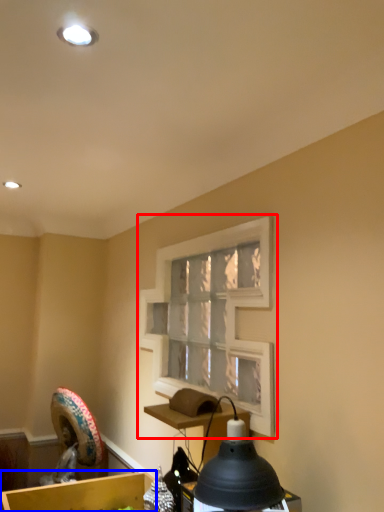
Question: Among these objects, which one is nearest to the camera, window frame (highlighted by a red box) or cardboard box (highlighted by a blue box)?

Choices:
 (A) window frame
 (B) cardboard box

Answer: (A)